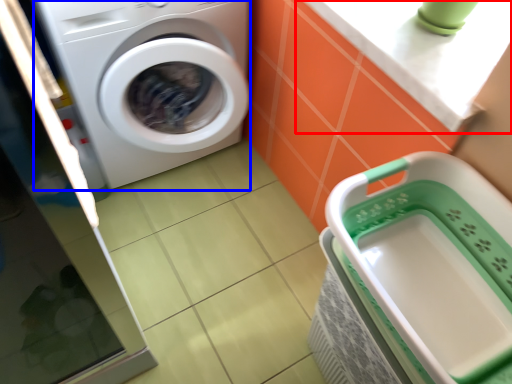
Question: Which of the following is the closest to the observer, counter top (highlighted by a red box) or washing machine (highlighted by a blue box)?

Choices:
 (A) counter top
 (B) washing machine

Answer: (A)